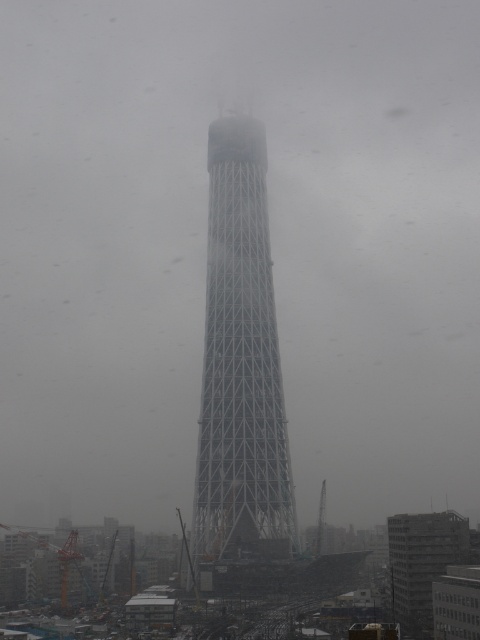
Question: Can you confirm if metallic lattice tower at center is positioned below white metallic tower at center?

Choices:
 (A) no
 (B) yes

Answer: (A)

Question: Does metallic lattice tower at center appear on the left side of white metallic tower at center?

Choices:
 (A) no
 (B) yes

Answer: (B)

Question: Which of the following is the farthest from the observer?

Choices:
 (A) metallic lattice tower at center
 (B) white metallic tower at center

Answer: (A)

Question: Which point is closer to the camera taking this photo?

Choices:
 (A) (250, 262)
 (B) (408, 636)

Answer: (B)

Question: Does metallic lattice tower at center have a lesser width compared to white metallic tower at center?

Choices:
 (A) yes
 (B) no

Answer: (B)